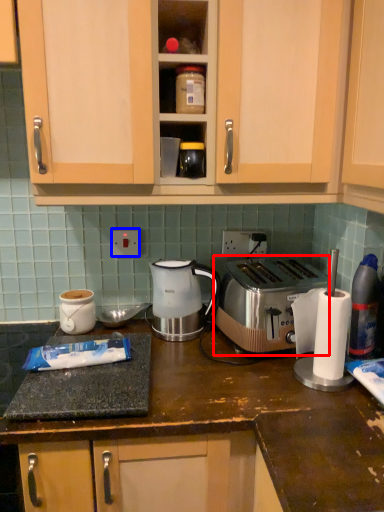
Question: Which point is further to the camera, toaster (highlighted by a red box) or electric outlet (highlighted by a blue box)?

Choices:
 (A) toaster
 (B) electric outlet

Answer: (B)